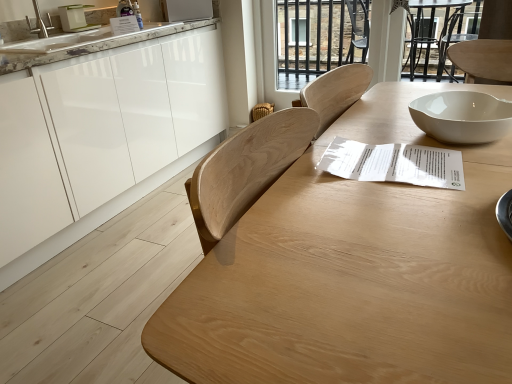
Question: Does white glossy cabinets at left turn towards natural wood table at center?

Choices:
 (A) no
 (B) yes

Answer: (B)

Question: From a real-world perspective, is white glossy cabinets at left located higher than natural wood table at center?

Choices:
 (A) no
 (B) yes

Answer: (A)

Question: Can you confirm if white glossy cabinets at left is shorter than natural wood table at center?

Choices:
 (A) no
 (B) yes

Answer: (A)

Question: Does white glossy cabinets at left have a greater width compared to natural wood table at center?

Choices:
 (A) no
 (B) yes

Answer: (B)

Question: Considering the relative sizes of white glossy cabinets at left and natural wood table at center in the image provided, is white glossy cabinets at left taller than natural wood table at center?

Choices:
 (A) yes
 (B) no

Answer: (A)

Question: Does white glossy cabinets at left lie in front of natural wood table at center?

Choices:
 (A) yes
 (B) no

Answer: (B)

Question: Are woven straw chair at center and white marble countertop at upper left beside each other?

Choices:
 (A) no
 (B) yes

Answer: (A)

Question: Is woven straw chair at center wider than white marble countertop at upper left?

Choices:
 (A) no
 (B) yes

Answer: (A)

Question: From the image's perspective, is woven straw chair at center under white marble countertop at upper left?

Choices:
 (A) no
 (B) yes

Answer: (B)

Question: Considering the relative sizes of woven straw chair at center and white marble countertop at upper left in the image provided, is woven straw chair at center shorter than white marble countertop at upper left?

Choices:
 (A) no
 (B) yes

Answer: (A)

Question: Could white marble countertop at upper left be considered to be inside woven straw chair at center?

Choices:
 (A) no
 (B) yes

Answer: (A)

Question: Can you confirm if woven straw chair at center is positioned to the left of white marble countertop at upper left?

Choices:
 (A) yes
 (B) no

Answer: (B)

Question: From the image's perspective, is transparent glass door at upper center located above white marble countertop at upper left?

Choices:
 (A) yes
 (B) no

Answer: (A)